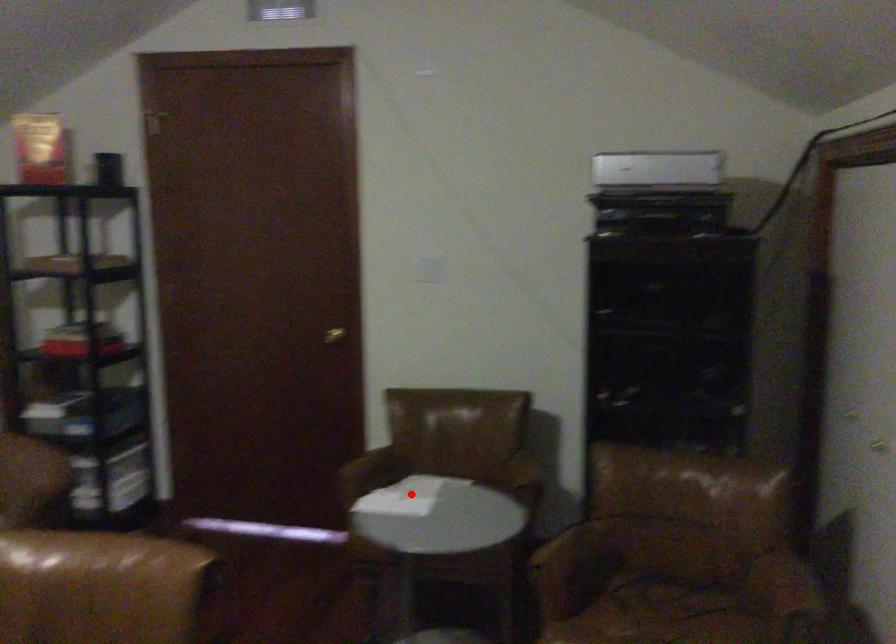
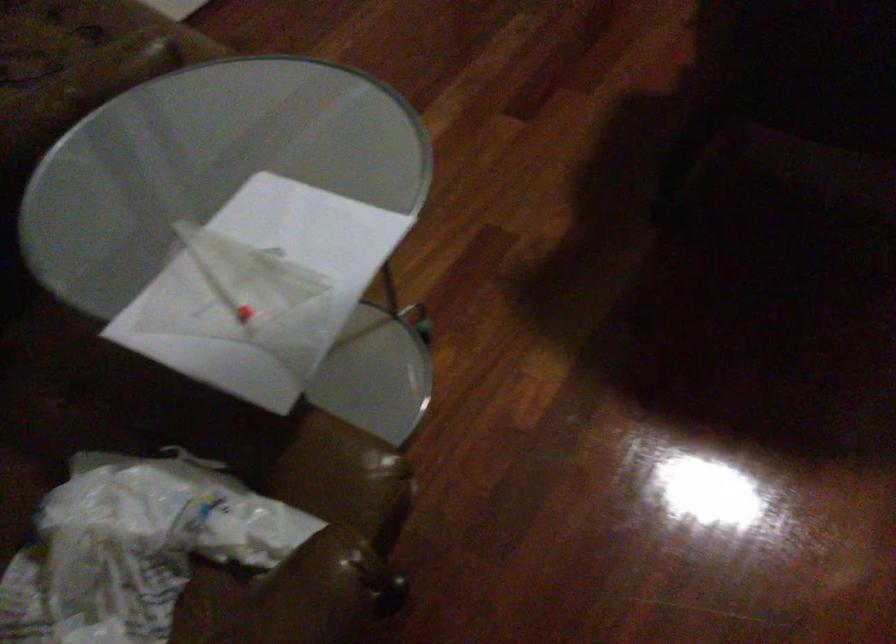
Question: I am providing you with two images of the same scene from different viewpoints. In image1, a red point is highlighted. Considering the same 3D point in image2, which of the following is correct?

Choices:
 (A) It is closer
 (B) It is farther

Answer: (A)